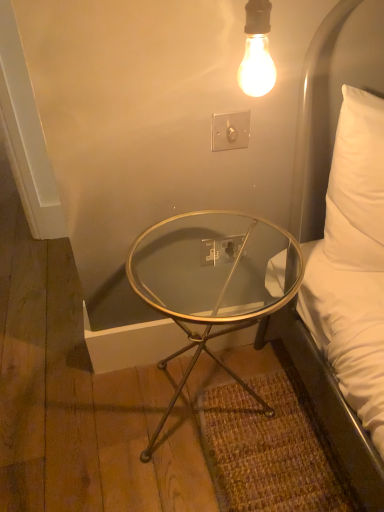
Question: Does white plastic switch at upper center, which is the second electric outlet from back to front, come in front of white plastic outlet at center, positioned as the 2th electric outlet in front-to-back order?

Choices:
 (A) no
 (B) yes

Answer: (B)

Question: From a real-world perspective, is white plastic switch at upper center, the first electric outlet from the top, under white plastic outlet at center, positioned as the 2th electric outlet in front-to-back order?

Choices:
 (A) yes
 (B) no

Answer: (B)

Question: Does white plastic switch at upper center, acting as the second electric outlet starting from the bottom, appear on the left side of white plastic outlet at center, marked as the 1th electric outlet in a back-to-front arrangement?

Choices:
 (A) no
 (B) yes

Answer: (B)

Question: Is white plastic switch at upper center, the first electric outlet from the top, in contact with white plastic outlet at center, positioned as the 2th electric outlet in front-to-back order?

Choices:
 (A) yes
 (B) no

Answer: (B)

Question: Considering the relative sizes of white plastic switch at upper center, acting as the second electric outlet starting from the bottom, and white plastic outlet at center, marked as the 1th electric outlet in a back-to-front arrangement, in the image provided, is white plastic switch at upper center, acting as the second electric outlet starting from the bottom, thinner than white plastic outlet at center, marked as the 1th electric outlet in a back-to-front arrangement,?

Choices:
 (A) no
 (B) yes

Answer: (A)

Question: Can you confirm if white plastic switch at upper center, which is the 1th electric outlet in front-to-back order, is wider than white plastic outlet at center, positioned as the 2th electric outlet in front-to-back order?

Choices:
 (A) yes
 (B) no

Answer: (A)

Question: From the image's perspective, is white plastic outlet at center, positioned as the 2th electric outlet in front-to-back order, above clear glass table at lower center?

Choices:
 (A) yes
 (B) no

Answer: (A)

Question: From a real-world perspective, is white plastic outlet at center, marked as the 1th electric outlet in a back-to-front arrangement, under clear glass table at lower center?

Choices:
 (A) no
 (B) yes

Answer: (A)

Question: From the image's perspective, is white plastic outlet at center, which is counted as the second electric outlet, starting from the top, located beneath clear glass table at lower center?

Choices:
 (A) no
 (B) yes

Answer: (A)

Question: Is the surface of white plastic outlet at center, marked as the 1th electric outlet in a back-to-front arrangement, in direct contact with clear glass table at lower center?

Choices:
 (A) no
 (B) yes

Answer: (A)

Question: Is white plastic outlet at center, which is counted as the first electric outlet, starting from the bottom, to the right of clear glass table at lower center from the viewer's perspective?

Choices:
 (A) no
 (B) yes

Answer: (B)

Question: Is white plastic outlet at center, which is counted as the second electric outlet, starting from the top, not inside clear glass table at lower center?

Choices:
 (A) no
 (B) yes

Answer: (B)

Question: From the image's perspective, is clear glass table at lower center under white plastic switch at upper center, acting as the second electric outlet starting from the bottom?

Choices:
 (A) no
 (B) yes

Answer: (B)